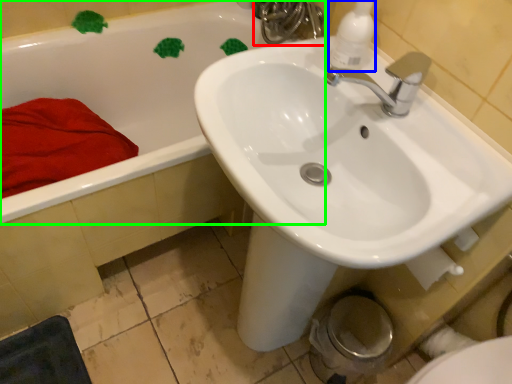
Question: Which is nearer to the plumbing fixture (highlighted by a red box)? soap dispenser (highlighted by a blue box) or bathtub (highlighted by a green box).

Choices:
 (A) soap dispenser
 (B) bathtub

Answer: (B)